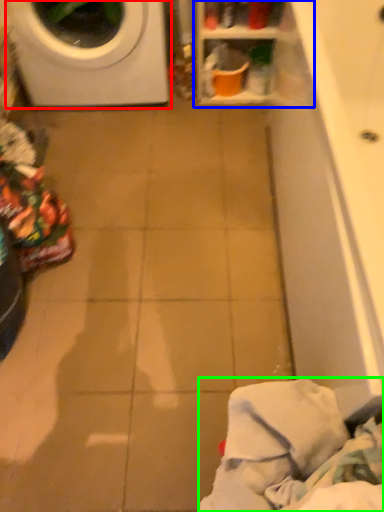
Question: Estimate the real-world distances between objects in this image. Which object is farther from washing machine (highlighted by a red box), shelf (highlighted by a blue box) or clothing (highlighted by a green box)?

Choices:
 (A) shelf
 (B) clothing

Answer: (B)